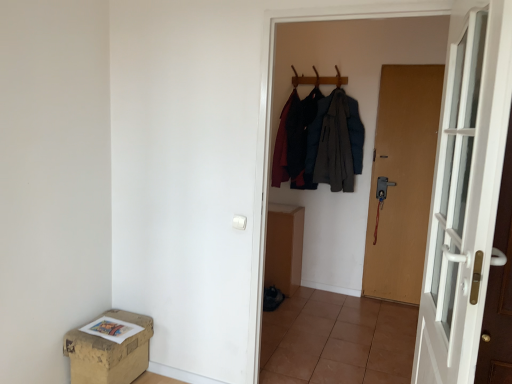
Question: Does brown cardboard box at lower left have a smaller size compared to brown matte door at right, the second door positioned from the left?

Choices:
 (A) yes
 (B) no

Answer: (A)

Question: From the image's perspective, does brown cardboard box at lower left appear lower than brown matte door at right, the second door viewed from the front?

Choices:
 (A) no
 (B) yes

Answer: (B)

Question: Is brown cardboard box at lower left with brown matte door at right, which is the 1th door from back to front?

Choices:
 (A) no
 (B) yes

Answer: (A)

Question: Is the depth of brown cardboard box at lower left greater than that of brown matte door at right, the second door viewed from the front?

Choices:
 (A) yes
 (B) no

Answer: (B)

Question: From a real-world perspective, is brown cardboard box at lower left on brown matte door at right, the second door positioned from the left?

Choices:
 (A) no
 (B) yes

Answer: (A)

Question: In terms of width, does brown cardboard box at lower left look wider or thinner when compared to white glass door at right, which ranks as the second door in right-to-left order?

Choices:
 (A) thin
 (B) wide

Answer: (B)

Question: Is brown cardboard box at lower left bigger or smaller than white glass door at right, acting as the 1th door starting from the left?

Choices:
 (A) small
 (B) big

Answer: (A)

Question: Choose the correct answer: Is brown cardboard box at lower left inside white glass door at right, acting as the 1th door starting from the left, or outside it?

Choices:
 (A) inside
 (B) outside

Answer: (B)

Question: Does point (73, 334) appear closer or farther from the camera than point (475, 178)?

Choices:
 (A) closer
 (B) farther

Answer: (B)

Question: Considering their positions, is brown tile at center located in front of or behind white glass door at right, acting as the 1th door starting from the left?

Choices:
 (A) behind
 (B) front

Answer: (A)

Question: In terms of width, does brown tile at center look wider or thinner when compared to white glass door at right, which ranks as the second door in right-to-left order?

Choices:
 (A) wide
 (B) thin

Answer: (A)

Question: In terms of height, does brown tile at center look taller or shorter compared to white glass door at right, placed as the second door when sorted from back to front?

Choices:
 (A) tall
 (B) short

Answer: (B)

Question: From the image's perspective, relative to white glass door at right, which is the first door from front to back, is brown tile at center above or below?

Choices:
 (A) above
 (B) below

Answer: (B)

Question: From a real-world perspective, is wooden coat hanger at upper center physically located above or below white glass door at right, which is the first door from front to back?

Choices:
 (A) above
 (B) below

Answer: (A)

Question: Considering the relative positions of wooden coat hanger at upper center and white glass door at right, which is the first door from front to back, in the image provided, is wooden coat hanger at upper center to the left or to the right of white glass door at right, which is the first door from front to back,?

Choices:
 (A) right
 (B) left

Answer: (B)